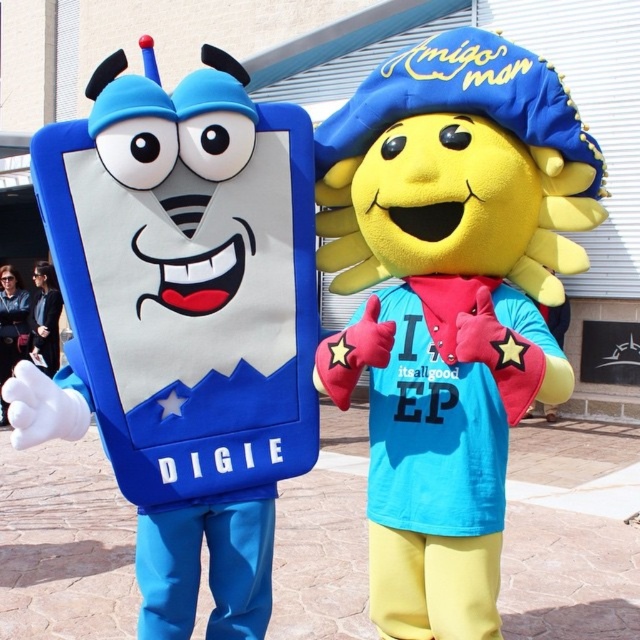
Who is taller, matte blue phone at left or black fabric jacket at lower left?

matte blue phone at left

Can you confirm if matte blue phone at left is positioned to the right of black fabric jacket at lower left?

Correct, you'll find matte blue phone at left to the right of black fabric jacket at lower left.

Which is behind, point (61, 285) or point (35, 320)?

The point (35, 320) is more distant.

In order to click on matte blue phone at left in this screenshot , I will do `click(182, 323)`.

In the scene shown: Is yellow plush sun at center to the left of dark blue leather jacket at lower left from the viewer's perspective?

Incorrect, yellow plush sun at center is not on the left side of dark blue leather jacket at lower left.

Which is in front, point (477, 516) or point (29, 304)?

Point (477, 516) is more forward.

Where is `yellow plush sun at center`? Image resolution: width=640 pixels, height=640 pixels. yellow plush sun at center is located at coordinates (449, 301).

Locate an element on the screen. Image resolution: width=640 pixels, height=640 pixels. yellow plush sun at center is located at coordinates (449, 301).

Between point (225, 56) and point (12, 307), which one is positioned behind?

The point (12, 307) is behind.

Does matte blue phone at left have a greater height compared to dark blue leather jacket at lower left?

Yes, matte blue phone at left is taller than dark blue leather jacket at lower left.

The width and height of the screenshot is (640, 640). Describe the element at coordinates (182, 323) in the screenshot. I see `matte blue phone at left` at that location.

Locate an element on the screen. The image size is (640, 640). matte blue phone at left is located at coordinates (182, 323).